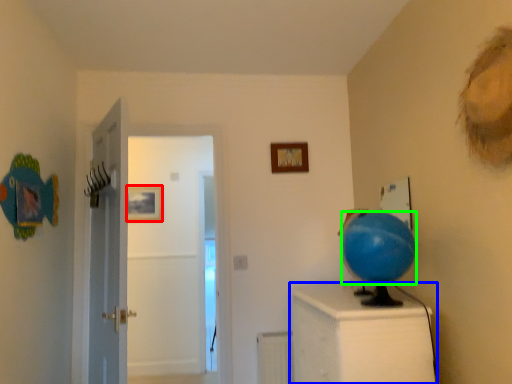
Question: Based on their relative distances, which object is farther from picture frame (highlighted by a red box)? Choose from furniture (highlighted by a blue box) and balloon (highlighted by a green box).

Choices:
 (A) furniture
 (B) balloon

Answer: (B)